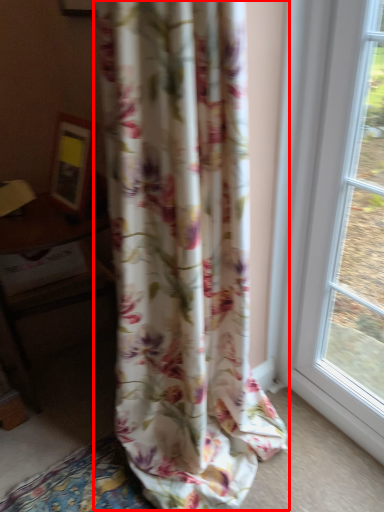
Question: From the image's perspective, where is curtain (annotated by the red box) located in relation to table in the image?

Choices:
 (A) below
 (B) above

Answer: (B)